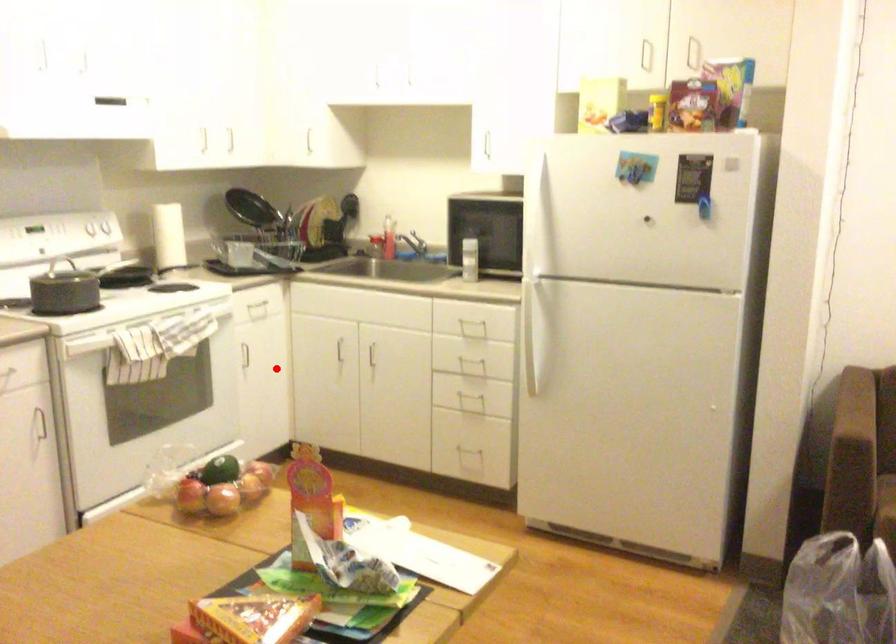
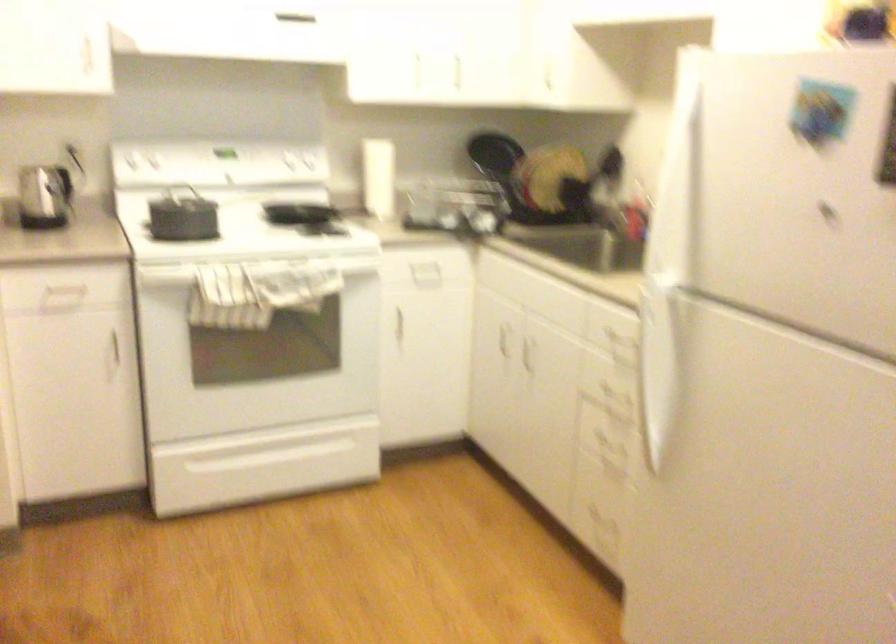
Where in the second image is the point corresponding to the highlighted location from the first image?

(425, 342)